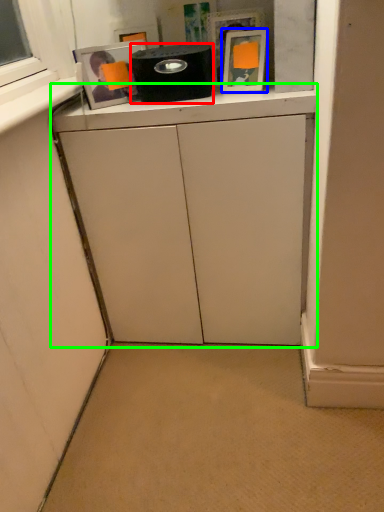
Question: Estimate the real-world distances between objects in this image. Which object is farther from appliance (highlighted by a red box), picture frame (highlighted by a blue box) or cabinetry (highlighted by a green box)?

Choices:
 (A) picture frame
 (B) cabinetry

Answer: (B)